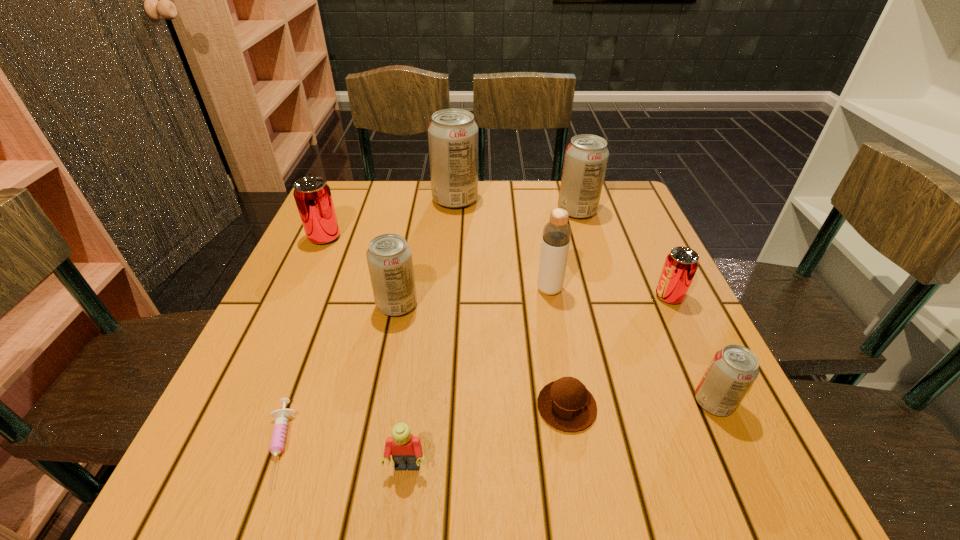
The width and height of the screenshot is (960, 540). In order to click on vacant area between the third shortest object and the rightmost gray soda can in this screenshot , I will do `click(561, 434)`.

Locate an element on the screen. Image resolution: width=960 pixels, height=540 pixels. free spot between the third biggest gray soda can and the syringe is located at coordinates (336, 375).

The height and width of the screenshot is (540, 960). In order to click on vacant area that lies between the leftmost soda can and the second shortest object in this screenshot , I will do `click(445, 322)`.

Find the location of a particular element. The width and height of the screenshot is (960, 540). free space between the syringe and the gray bottle is located at coordinates (413, 367).

The width and height of the screenshot is (960, 540). In order to click on free space between the Lego and the tallest soda can in this screenshot , I will do `click(431, 333)`.

Locate an element on the screen. free spot between the third farthest gray soda can and the bottle is located at coordinates (473, 297).

This screenshot has width=960, height=540. I want to click on vacant point located between the third smallest gray soda can and the leftmost object, so pyautogui.click(x=451, y=224).

The height and width of the screenshot is (540, 960). I want to click on empty space between the bottle and the third farthest gray soda can, so click(x=473, y=297).

I want to click on vacant area that lies between the Lego and the third soda can from right to left, so click(x=492, y=339).

This screenshot has width=960, height=540. Find the location of `object that is the closest to the third biggest gray soda can`. object that is the closest to the third biggest gray soda can is located at coordinates (312, 195).